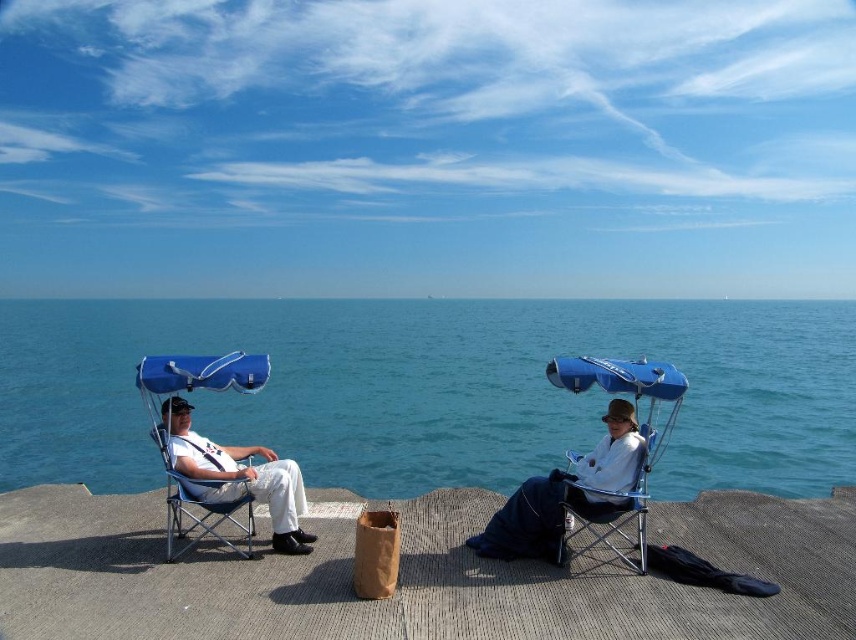
Between concrete dock at center and white cotton shirt at center, which one appears on the right side from the viewer's perspective?

white cotton shirt at center is more to the right.

Which is above, concrete dock at center or white cotton shirt at center?

white cotton shirt at center

Measure the distance between concrete dock at center and camera.

concrete dock at center and camera are 9.61 meters apart from each other.

The width and height of the screenshot is (856, 640). I want to click on concrete dock at center, so click(x=417, y=577).

Looking at this image, who is more distant from viewer, (x=753, y=538) or (x=224, y=488)?

Point (x=753, y=538)

Who is more distant from viewer, (792, 621) or (192, 467)?

Point (192, 467)

Where is `concrete dock at center`? concrete dock at center is located at coordinates (417, 577).

Can you confirm if white cotton shirt at center is thinner than white matte pants at left?

Incorrect, white cotton shirt at center's width is not less than white matte pants at left's.

Where is `white cotton shirt at center`? white cotton shirt at center is located at coordinates (568, 493).

You are a GUI agent. You are given a task and a screenshot of the screen. Output one action in this format:
    pyautogui.click(x=<x>, y=<y>)
    Task: Click on the white cotton shirt at center
    This screenshot has height=640, width=856.
    Given the screenshot: What is the action you would take?
    pyautogui.click(x=568, y=493)